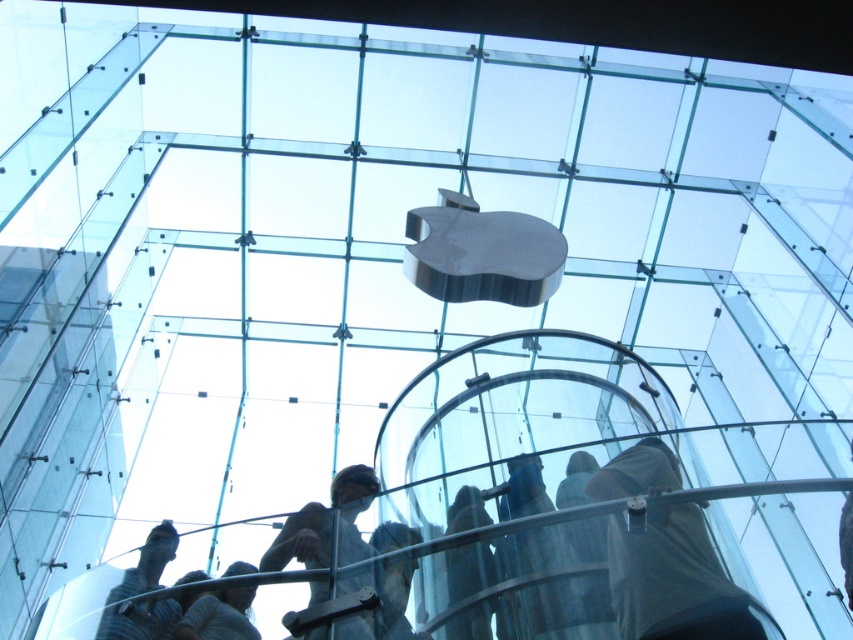
Question: Which point is farther to the camera?

Choices:
 (A) (114, 620)
 (B) (329, 564)

Answer: (A)

Question: Which object appears closest to the camera in this image?

Choices:
 (A) striped fabric shirt at lower left
 (B) metallic statue at center
 (C) gray fabric shirt at lower right
 (D) gray fabric shirt at lower center

Answer: (C)

Question: Is striped fabric shirt at lower left to the right of gray fabric shirt at lower center from the viewer's perspective?

Choices:
 (A) no
 (B) yes

Answer: (A)

Question: Can you confirm if gray fabric shirt at lower right is positioned above gray fabric shirt at lower center?

Choices:
 (A) yes
 (B) no

Answer: (A)

Question: Does metallic statue at center appear on the left side of dark gray fabric at lower center?

Choices:
 (A) no
 (B) yes

Answer: (B)

Question: Which point is closer to the camera?

Choices:
 (A) gray fabric shirt at lower right
 (B) gray fabric shirt at lower center

Answer: (A)